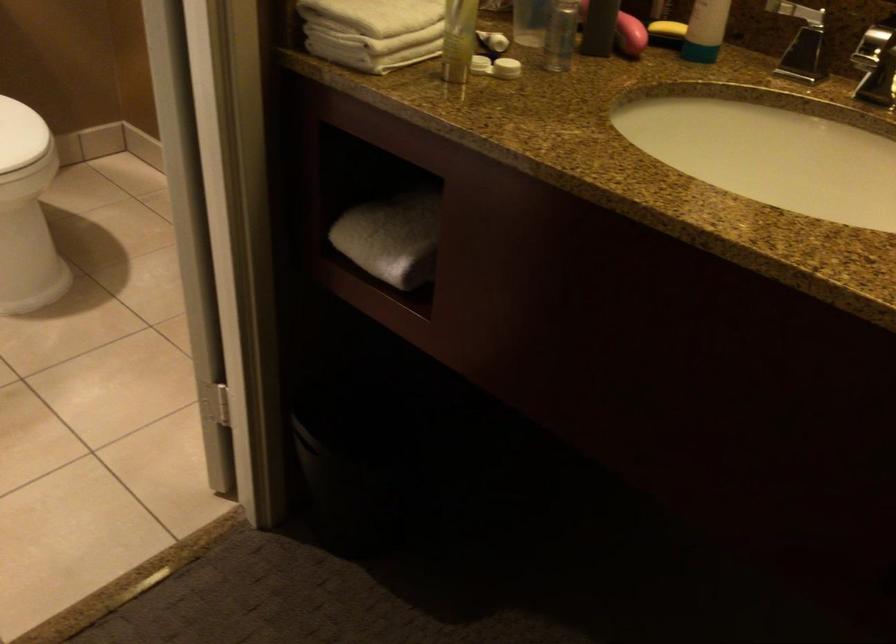
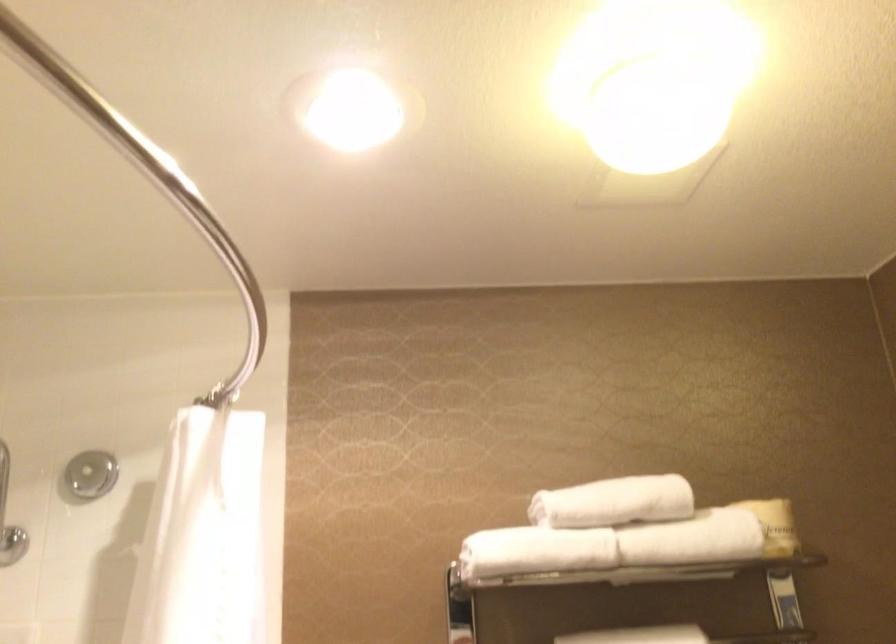
First-person continuous shooting, in which direction is the camera rotating?

The rotation direction of the camera is left-up.